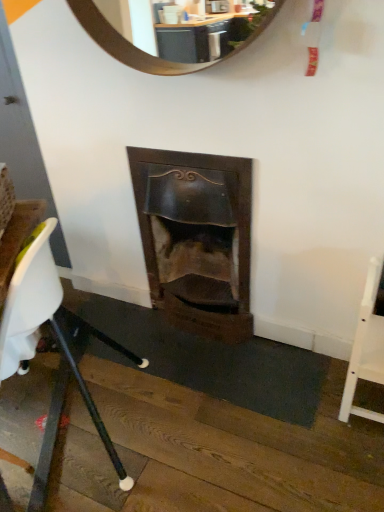
Locate an element on the screen. Image resolution: width=384 pixels, height=512 pixels. vacant area that is in front of white wood chair at right, the first chair viewed from the right is located at coordinates (354, 448).